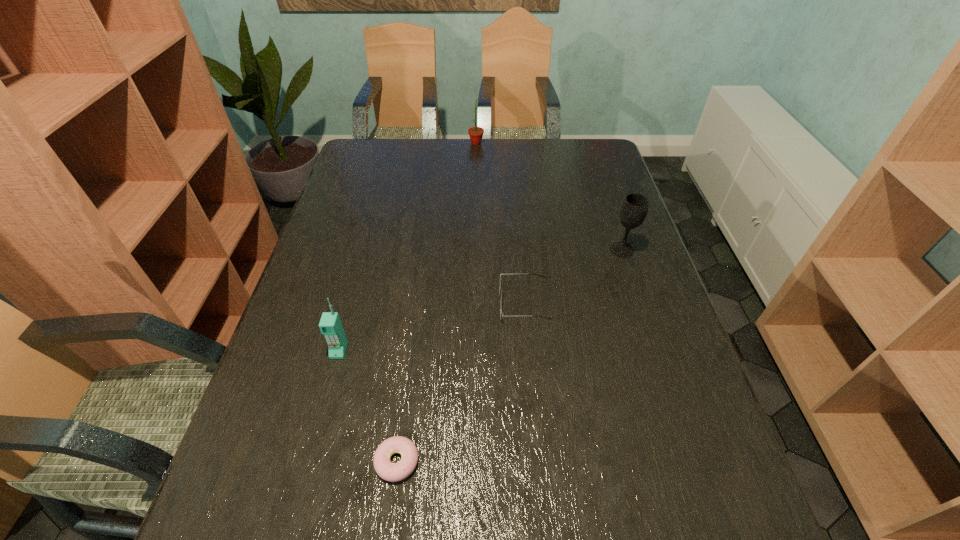
This screenshot has width=960, height=540. I want to click on sunflower, so click(476, 133).

Where is `the farthest object`? The width and height of the screenshot is (960, 540). the farthest object is located at coordinates (476, 133).

Locate an element on the screen. This screenshot has height=540, width=960. the second farthest object is located at coordinates (634, 208).

Find the location of `wineglass`. wineglass is located at coordinates (634, 208).

You are a GUI agent. You are given a task and a screenshot of the screen. Output one action in this format:
    pyautogui.click(x=<x>, y=<y>)
    Task: Click on the leftmost object
    The height and width of the screenshot is (540, 960).
    Given the screenshot: What is the action you would take?
    pyautogui.click(x=330, y=325)

Identify the location of the fourth farthest object. (330, 325).

I want to click on the second object from right to left, so click(x=501, y=315).

Locate an element on the screen. the fourth tallest object is located at coordinates (501, 315).

Locate an element on the screen. The image size is (960, 540). the nearest object is located at coordinates (393, 472).

Find the location of a particular element. The height and width of the screenshot is (540, 960). the second object from left to right is located at coordinates (393, 472).